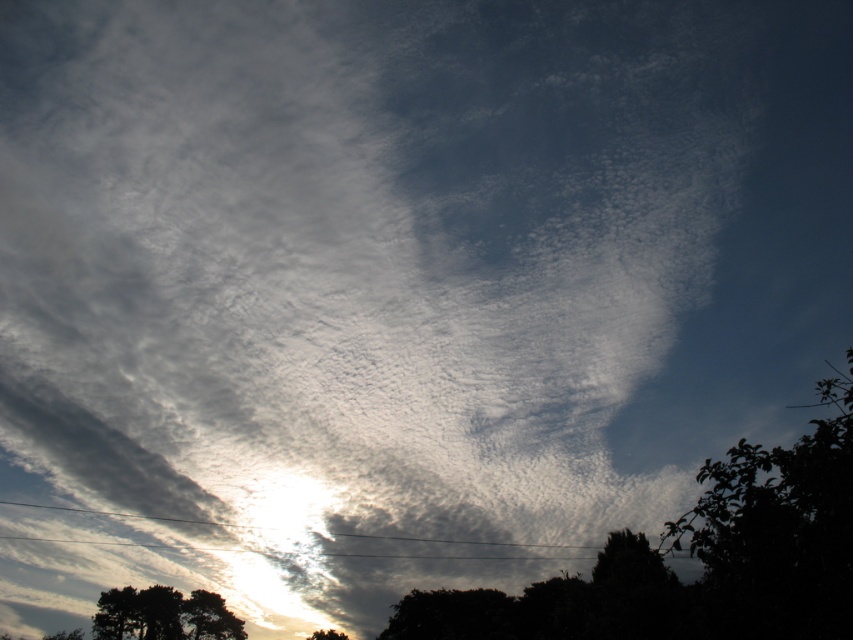
Question: Is green leafy tree at lower right positioned before green leafy tree at lower left?

Choices:
 (A) no
 (B) yes

Answer: (B)

Question: Among these objects, which one is nearest to the camera?

Choices:
 (A) dark green leafy tree at lower center
 (B) green leafy tree at lower center
 (C) silhouette bark tree at lower left

Answer: (A)

Question: Can you confirm if green leafy tree at lower right is smaller than green leafy tree at lower left?

Choices:
 (A) no
 (B) yes

Answer: (A)

Question: Which of the following is the closest to the observer?

Choices:
 (A) (403, 604)
 (B) (317, 636)
 (C) (94, 632)
 (D) (201, 621)

Answer: (A)

Question: Does silhouette bark tree at lower left have a greater width compared to green leafy tree at lower center?

Choices:
 (A) yes
 (B) no

Answer: (A)

Question: Among these objects, which one is nearest to the camera?

Choices:
 (A) dark green leafy tree at lower center
 (B) green leafy tree at lower right
 (C) green leafy tree at lower left
 (D) silhouette bark tree at lower left

Answer: (B)